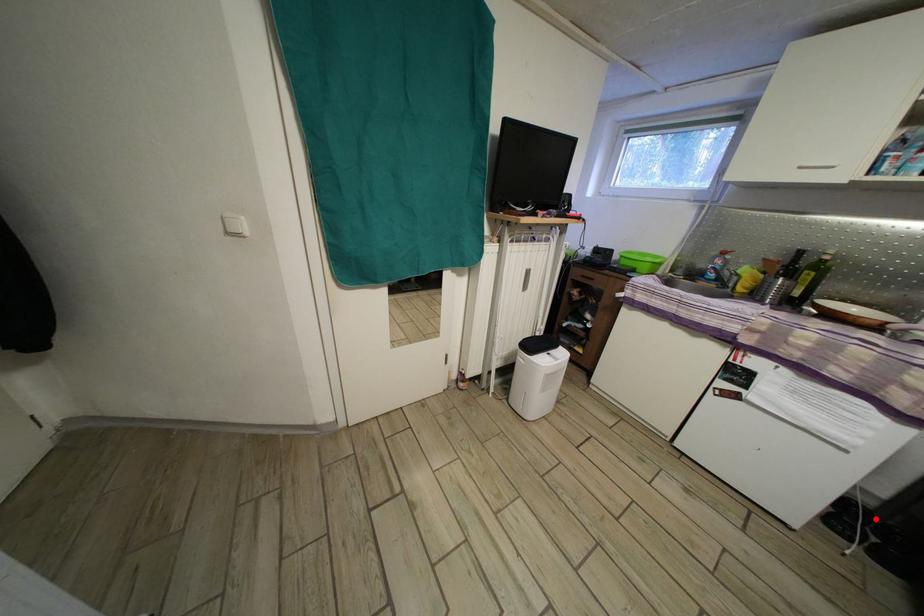
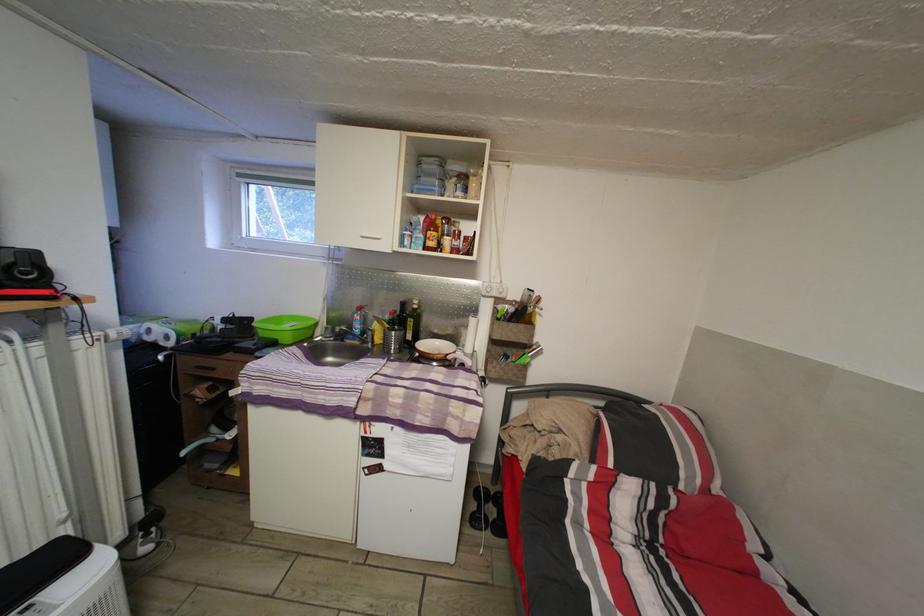
Question: I am providing you with two images of the same scene from different viewpoints. Image1 has a red point marked. In image2, the corresponding 3D location appears at what relative position? Reply with the corresponding letter.

Choices:
 (A) Closer
 (B) Farther

Answer: (A)